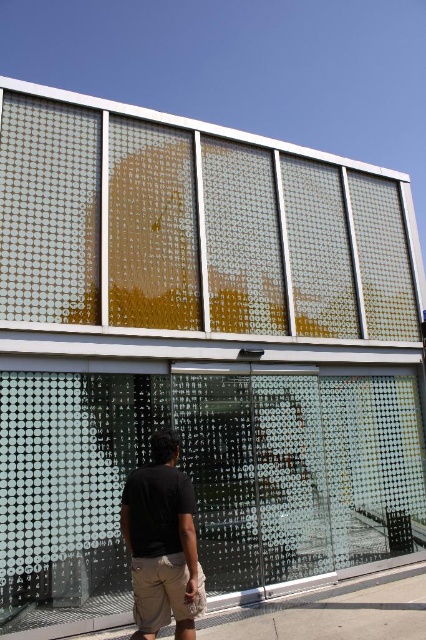
You are standing in front of the modern architectural structure. There is a transparent glass window at upper center represented by point (195,227). Can you see the person walking away in the foreground through this window?

The transparent glass window at upper center is represented by point (195,227). Since the window is transparent and the person is in the foreground, the person would block the view through the window, making it impossible to see through to the other side.

You are standing in front of the modern architectural structure and notice two points marked on the facade. One is at point coordinates (14, 182) and the other at (163, 579). Which point is closer to you?

Point (14, 182) is closer to you because it is further to the camera than point (163, 579).